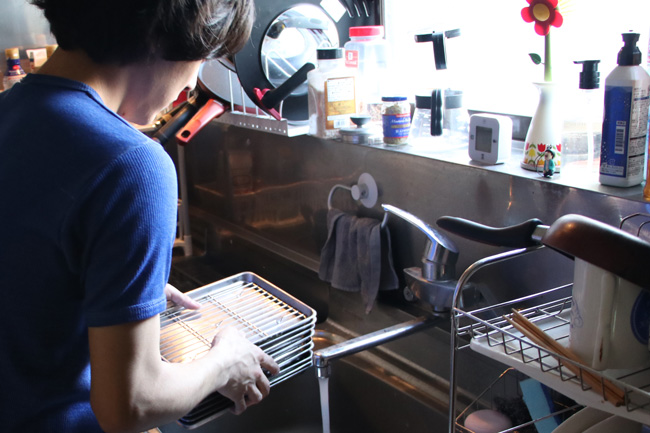
The height and width of the screenshot is (433, 650). Find the location of `sink`. sink is located at coordinates (374, 396).